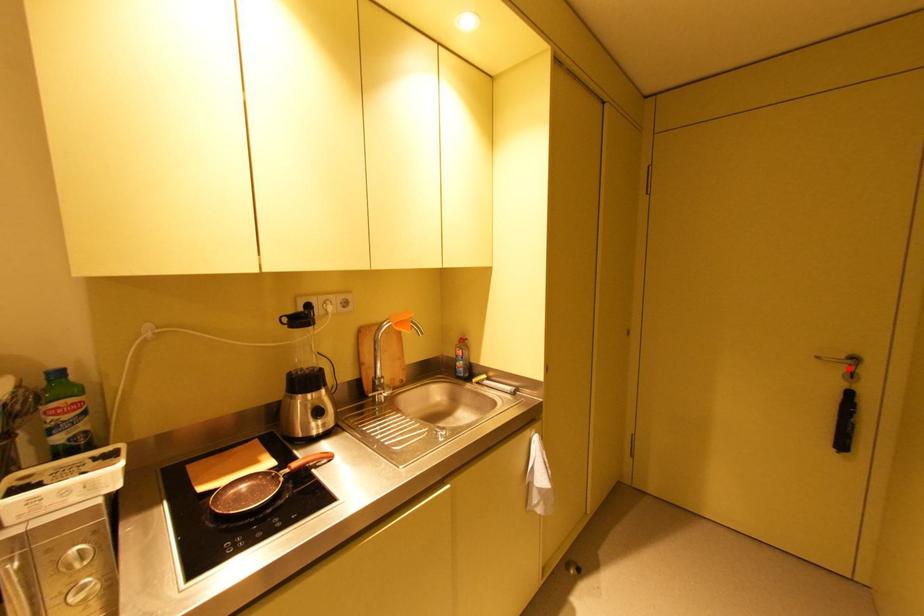
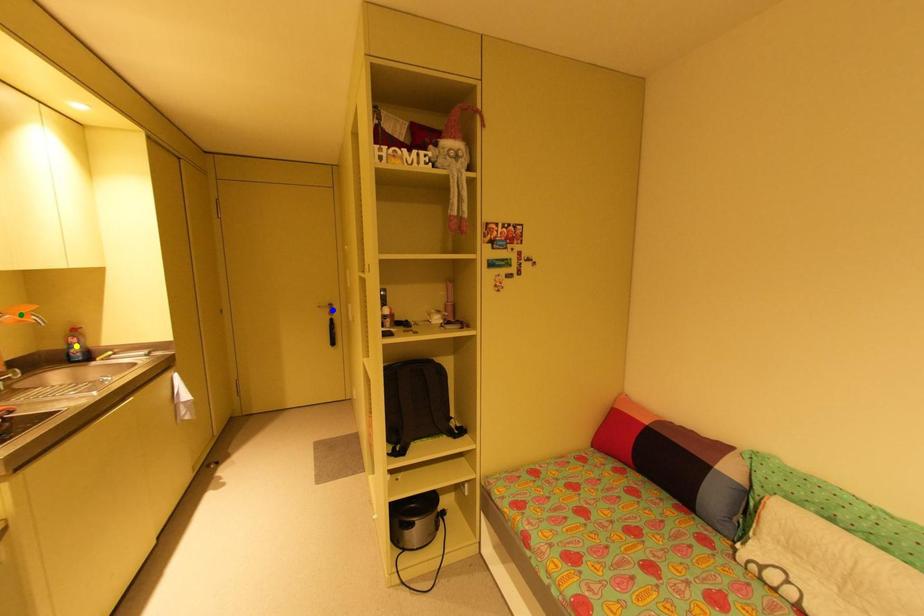
Question: I am providing you with two images of the same scene from different viewpoints. A red point is marked on the first image. You are given multiple points on the second image. In image 2, which mark is for the same physical point as the one in image 1?

Choices:
 (A) blue point
 (B) yellow point
 (C) green point

Answer: (A)